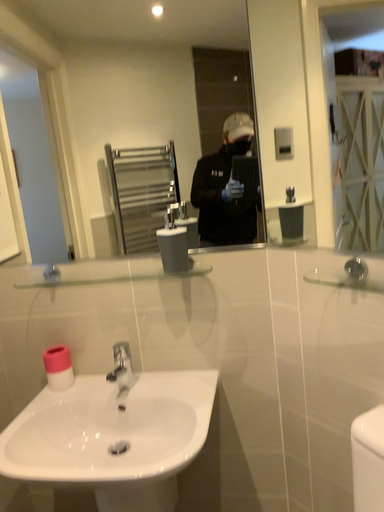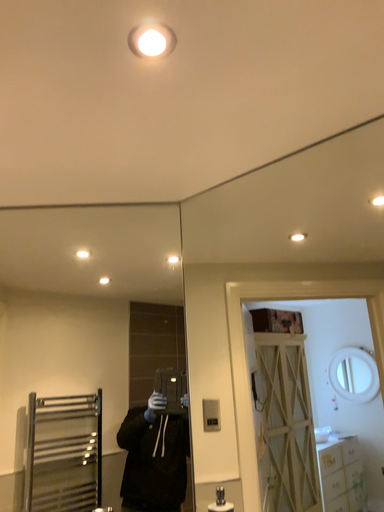
Question: Which way did the camera rotate in the video?

Choices:
 (A) rotated downward
 (B) rotated upward

Answer: (B)